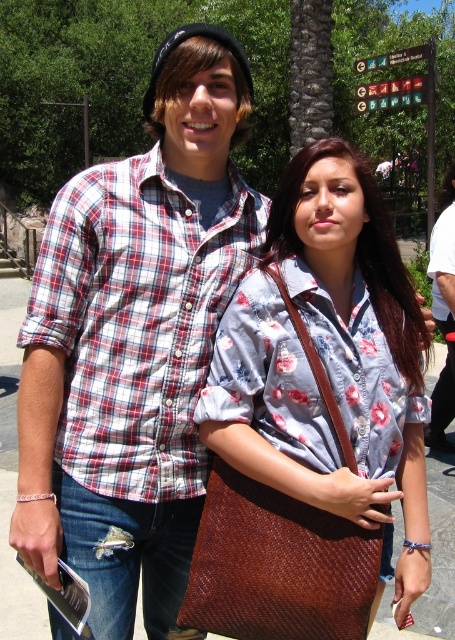
Question: Which point appears closest to the camera in this image?

Choices:
 (A) (298, 388)
 (B) (131, 358)

Answer: (A)

Question: Is brown woven bag at center to the left of plaid cotton shirt at upper left from the viewer's perspective?

Choices:
 (A) no
 (B) yes

Answer: (A)

Question: Does brown woven bag at center have a greater width compared to plaid cotton shirt at upper left?

Choices:
 (A) yes
 (B) no

Answer: (B)

Question: Does brown woven bag at center appear on the right side of plaid cotton shirt at upper left?

Choices:
 (A) yes
 (B) no

Answer: (A)